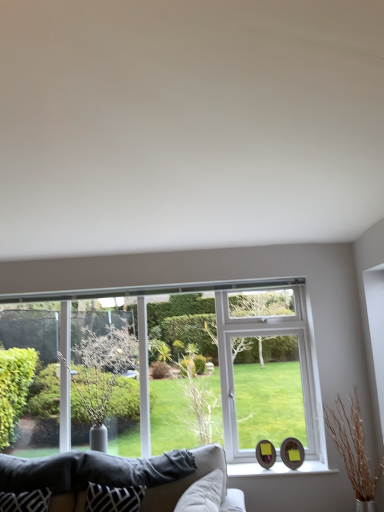
At what (x,y) coordinates should I click in order to perform the action: click on velvet beige couch at lower center. Please return your answer as a coordinate pair (x, y). Looking at the image, I should click on (69, 474).

What do you see at coordinates (104, 378) in the screenshot? Image resolution: width=384 pixels, height=512 pixels. I see `green leafy tree at left` at bounding box center [104, 378].

Identify the location of green leafy tree at left. The image size is (384, 512). (104, 378).

Describe the element at coordinates (113, 498) in the screenshot. This screenshot has height=512, width=384. I see `blue and white fabric pillow at lower center` at that location.

What is the approximate width of clear glass window at center?

clear glass window at center is 10.27 centimeters in width.

Locate an element on the screen. The height and width of the screenshot is (512, 384). white glossy window sill at lower center is located at coordinates (277, 469).

Does white glossy window sill at lower center turn towards green leafy tree at left?

No, white glossy window sill at lower center does not turn towards green leafy tree at left.

Which point is more forward, (232, 470) or (133, 407)?

The point (232, 470) is in front.

Locate an element on the screen. This screenshot has height=512, width=384. window sill that appears below the green leafy tree at left (from a real-world perspective) is located at coordinates (277, 469).

In the image, is white glossy window sill at lower center on the left side or the right side of green leafy tree at left?

In the image, white glossy window sill at lower center appears on the right side of green leafy tree at left.

Can we say green leafy tree at left lies outside blue and white fabric pillow at lower center?

green leafy tree at left is positioned outside blue and white fabric pillow at lower center.

Does point (80, 392) come in front of point (98, 501)?

That is False.

Considering the sizes of objects green leafy tree at left and blue and white fabric pillow at lower center in the image provided, who is shorter, green leafy tree at left or blue and white fabric pillow at lower center?

blue and white fabric pillow at lower center is shorter.

Between green leafy tree at left and blue and white fabric pillow at lower center, which one has larger size?

With larger size is green leafy tree at left.

Is white glossy window sill at lower center located outside blue and white fabric pillow at lower center?

Indeed, white glossy window sill at lower center is completely outside blue and white fabric pillow at lower center.

Considering the relative sizes of white glossy window sill at lower center and blue and white fabric pillow at lower center in the image provided, is white glossy window sill at lower center shorter than blue and white fabric pillow at lower center?

Yes, white glossy window sill at lower center is shorter than blue and white fabric pillow at lower center.

Considering the positions of objects white glossy window sill at lower center and blue and white fabric pillow at lower center in the image provided, who is in front, white glossy window sill at lower center or blue and white fabric pillow at lower center?

blue and white fabric pillow at lower center.

Is velvet beige couch at lower center not inside white glossy window sill at lower center?

Indeed, velvet beige couch at lower center is completely outside white glossy window sill at lower center.

Which of these two, velvet beige couch at lower center or white glossy window sill at lower center, is thinner?

white glossy window sill at lower center.

Is velvet beige couch at lower center oriented towards white glossy window sill at lower center?

No, velvet beige couch at lower center is not aimed at white glossy window sill at lower center.

Considering the relative sizes of velvet beige couch at lower center and white glossy window sill at lower center in the image provided, is velvet beige couch at lower center bigger than white glossy window sill at lower center?

Yes.

Find the location of a particular element. pillow to the left of white glossy window sill at lower center is located at coordinates (113, 498).

Looking at this image, is white glossy window sill at lower center at the back of blue and white fabric pillow at lower center?

blue and white fabric pillow at lower center is not turned away from white glossy window sill at lower center.

Does blue and white fabric pillow at lower center have a greater width compared to white glossy window sill at lower center?

In fact, blue and white fabric pillow at lower center might be narrower than white glossy window sill at lower center.

From the image's perspective, does blue and white fabric pillow at lower center appear higher than white glossy window sill at lower center?

Yes, from the image's perspective, blue and white fabric pillow at lower center is above white glossy window sill at lower center.

Considering the relative sizes of blue and white fabric pillow at lower center and green leafy tree at left in the image provided, is blue and white fabric pillow at lower center shorter than green leafy tree at left?

Yes, blue and white fabric pillow at lower center is shorter than green leafy tree at left.

Considering the relative positions of blue and white fabric pillow at lower center and green leafy tree at left in the image provided, is blue and white fabric pillow at lower center to the right of green leafy tree at left from the viewer's perspective?

Yes, blue and white fabric pillow at lower center is to the right of green leafy tree at left.

Is blue and white fabric pillow at lower center wider or thinner than green leafy tree at left?

Considering their sizes, blue and white fabric pillow at lower center looks slimmer than green leafy tree at left.

Is clear glass window at center not close to white glossy window sill at lower center?

No, clear glass window at center is in close proximity to white glossy window sill at lower center.

Measure the distance from clear glass window at center to white glossy window sill at lower center.

They are 36.00 inches apart.

Which of these two, clear glass window at center or white glossy window sill at lower center, is bigger?

With larger size is clear glass window at center.

From a real-world perspective, which is physically above, clear glass window at center or white glossy window sill at lower center?

From a 3D spatial view, clear glass window at center is above.

Locate an element on the screen. The width and height of the screenshot is (384, 512). window sill on the right of green leafy tree at left is located at coordinates (277, 469).

The width and height of the screenshot is (384, 512). What are the coordinates of `pillow below the green leafy tree at left (from the image's perspective)` in the screenshot? It's located at (113, 498).

Based on their spatial positions, is clear glass window at center or white glossy window sill at lower center closer to green leafy tree at left?

The object closer to green leafy tree at left is clear glass window at center.

Looking at the image, which one is located closer to green leafy tree at left, blue and white fabric pillow at lower center or velvet beige couch at lower center?

velvet beige couch at lower center is closer to green leafy tree at left.

When comparing their distances from white glossy window sill at lower center, does velvet beige couch at lower center or green leafy tree at left seem further?

green leafy tree at left is further to white glossy window sill at lower center.

When comparing their distances from velvet beige couch at lower center, does blue and white fabric pillow at lower center or white glossy window sill at lower center seem closer?

blue and white fabric pillow at lower center lies closer to velvet beige couch at lower center than the other object.

Looking at the image, which one is located further to green leafy tree at left, velvet beige couch at lower center or clear glass window at center?

The object further to green leafy tree at left is velvet beige couch at lower center.

Based on their spatial positions, is green leafy tree at left or white glossy window sill at lower center further from clear glass window at center?

white glossy window sill at lower center is further to clear glass window at center.

From the image, which object appears to be farther from white glossy window sill at lower center, green leafy tree at left or blue and white fabric pillow at lower center?

Among the two, green leafy tree at left is located further to white glossy window sill at lower center.

Which object lies further to the anchor point blue and white fabric pillow at lower center, white glossy window sill at lower center or clear glass window at center?

clear glass window at center is positioned further to the anchor blue and white fabric pillow at lower center.

This screenshot has height=512, width=384. I want to click on pillow between green leafy tree at left and white glossy window sill at lower center in the horizontal direction, so click(x=113, y=498).

Where is `window between green leafy tree at left and white glossy window sill at lower center`? The width and height of the screenshot is (384, 512). window between green leafy tree at left and white glossy window sill at lower center is located at coordinates 173,366.

Image resolution: width=384 pixels, height=512 pixels. Find the location of `tree located between blue and white fabric pillow at lower center and clear glass window at center in the depth direction`. tree located between blue and white fabric pillow at lower center and clear glass window at center in the depth direction is located at coordinates (104, 378).

Where is `pillow between velvet beige couch at lower center and green leafy tree at left in the front-back direction`? This screenshot has height=512, width=384. pillow between velvet beige couch at lower center and green leafy tree at left in the front-back direction is located at coordinates (113, 498).